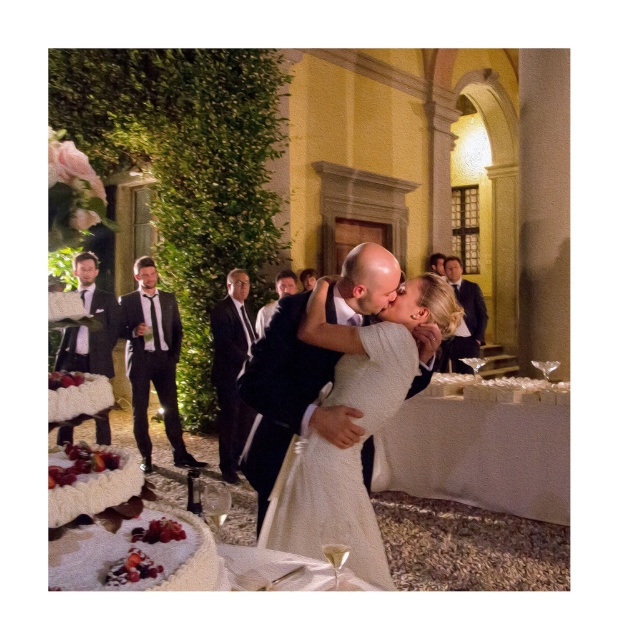
You are a photographer at the wedding reception. You want to take a photo of the white textured cake at lower left and the black textured suit at left. Which object should you focus on first if you want to capture both in the same frame without moving the camera?

The white textured cake at lower left has a lesser height compared to the black textured suit at left, so you should focus on the black textured suit at left first because it is taller and will require more attention in the frame.

You are a photographer at the wedding reception. You need to capture a photo that includes both the white textured cake at lower left and the black textured suit at left. Since the cake is smaller, where should you position yourself to ensure both objects are clearly visible in the frame?

To ensure both the white textured cake at lower left and the black textured suit at left are clearly visible in the frame, position yourself so that the cake is closer to the foreground and the suit is in the background. Since the cake is smaller, this composition will balance their sizes in the photo.